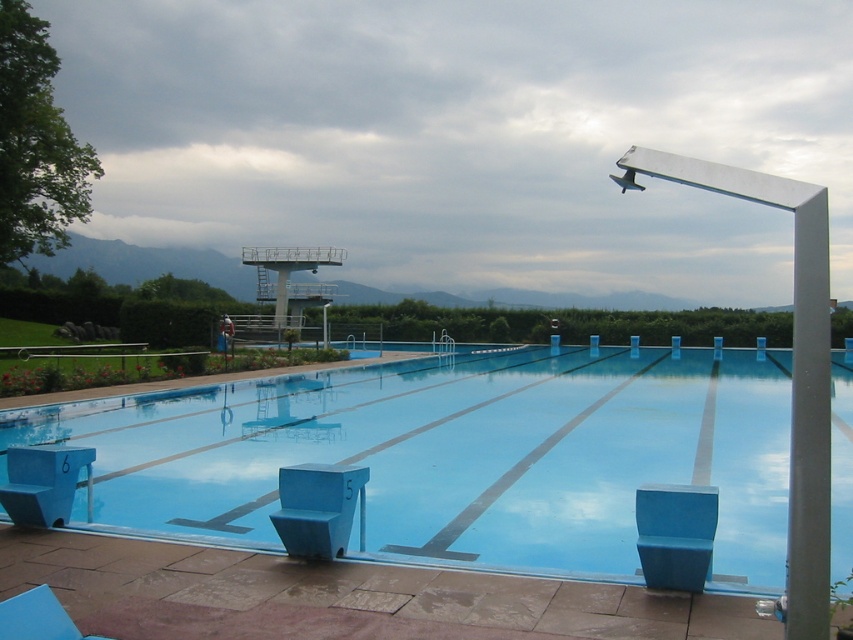
Which is more to the right, blue smooth diving board at upper center or blue plastic chair at lower center?

Positioned to the right is blue smooth diving board at upper center.

Who is more forward, (213, 426) or (345, 522)?

Point (345, 522) is in front.

Is point (556, 568) closer to viewer compared to point (293, 522)?

No, (556, 568) is further to viewer.

The image size is (853, 640). Find the location of `blue smooth diving board at upper center`. blue smooth diving board at upper center is located at coordinates (457, 456).

Who is shorter, blue smooth diving board at upper center or blue plastic chair at lower left?

blue plastic chair at lower left is shorter.

Who is more distant from viewer, [265,420] or [62,461]?

Point [265,420]

Who is more forward, (x=196, y=396) or (x=86, y=516)?

Positioned in front is point (x=86, y=516).

I want to click on blue smooth diving board at upper center, so click(x=457, y=456).

Who is taller, blue plastic chair at lower center or blue plastic chair at lower left?

blue plastic chair at lower left

Can you confirm if blue plastic chair at lower center is positioned to the left of blue plastic chair at lower left?

Incorrect, blue plastic chair at lower center is not on the left side of blue plastic chair at lower left.

Find the location of `blue plastic chair at lower center`. blue plastic chair at lower center is located at coordinates tap(318, 508).

This screenshot has width=853, height=640. Identify the location of blue plastic chair at lower center. [x=318, y=508].